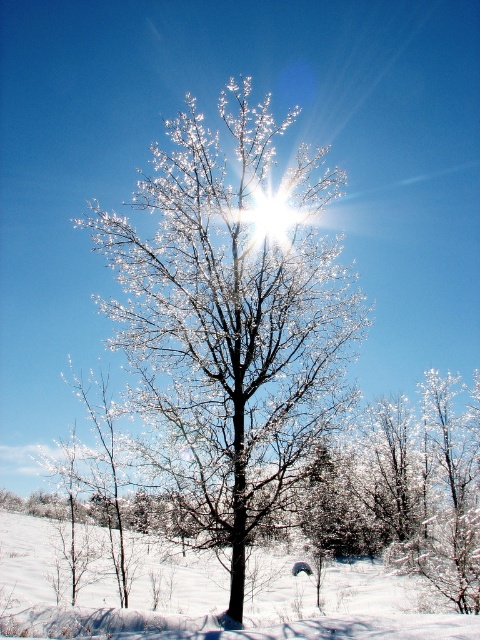
You are an artist trying to paint the winter scene. You notice the snowy branches at center and the white powdery snow at lower center. Which one appears narrower in your painting?

The snowy branches at center appear narrower because their width is less than that of the white powdery snow at lower center.

Based on the scene description, where is the snowy branches at center located in terms of 2D coordinates?

The snowy branches at center are located at the 2D coordinates of point (230,323).

You are an observer standing in the winter landscape scene. You see the snowy branches at center and the white powdery snow at lower center. Which object is located above the other?

The snowy branches at center is positioned over white powdery snow at lower center.